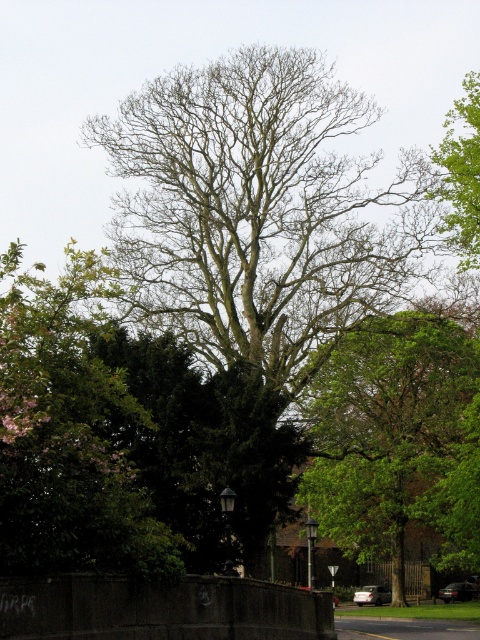
Does bare branches at center appear under green leafy tree at upper right?

Yes.

Is bare branches at center positioned before green leafy tree at upper right?

Yes, bare branches at center is closer to the viewer.

Who is more distant from viewer, (247, 61) or (469, 218)?

The point (247, 61) is more distant.

The width and height of the screenshot is (480, 640). What are the coordinates of `bare branches at center` in the screenshot? It's located at (259, 212).

Who is positioned more to the right, bare branches at center or green leafy tree at center?

Positioned to the right is green leafy tree at center.

Is point (252, 266) behind point (389, 484)?

No, it is not.

Identify the location of bare branches at center. (259, 212).

Who is more forward, (460, 561) or (445, 160)?

Point (445, 160) is more forward.

In the scene shown: Can you confirm if green leafy tree at center is positioned above green leafy tree at upper right?

Actually, green leafy tree at center is below green leafy tree at upper right.

Measure the distance between green leafy tree at center and camera.

green leafy tree at center and camera are 38.54 meters apart.

This screenshot has height=640, width=480. In order to click on green leafy tree at center in this screenshot , I will do `click(396, 440)`.